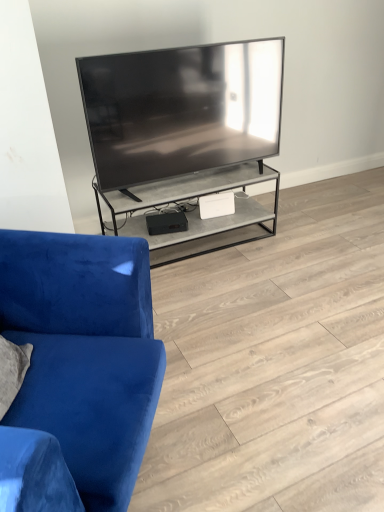
At what (x,y) coordinates should I click in order to perform the action: click on free spot above blue velvet couch at left (from a real-world perspective). Please return your answer as a coordinate pair (x, y). Looking at the image, I should click on (274, 303).